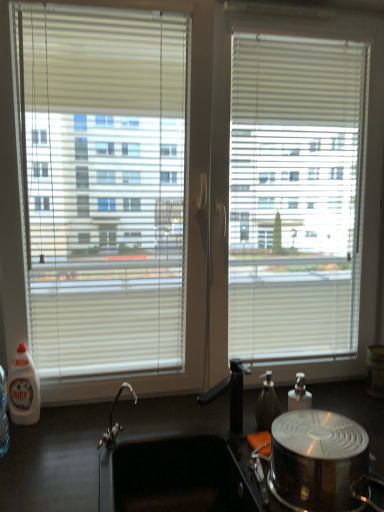
Question: Is shiny metallic pot at lower right next to white plastic bottle at left, which appears as the second bottle when viewed from the right?

Choices:
 (A) yes
 (B) no

Answer: (B)

Question: From the image's perspective, is shiny metallic pot at lower right below white plastic bottle at left, which appears as the second bottle when viewed from the right?

Choices:
 (A) no
 (B) yes

Answer: (B)

Question: Is shiny metallic pot at lower right to the right of white plastic bottle at left, which appears as the second bottle when viewed from the right, from the viewer's perspective?

Choices:
 (A) yes
 (B) no

Answer: (A)

Question: From a real-world perspective, is shiny metallic pot at lower right below white plastic bottle at left, which appears as the second bottle when viewed from the right?

Choices:
 (A) yes
 (B) no

Answer: (A)

Question: Does shiny metallic pot at lower right lie in front of white plastic bottle at left, placed as the first bottle when sorted from left to right?

Choices:
 (A) yes
 (B) no

Answer: (A)

Question: Would you say shiny metallic pot at lower right contains white plastic bottle at left, which appears as the second bottle when viewed from the right?

Choices:
 (A) yes
 (B) no

Answer: (B)

Question: Considering the relative positions of shiny metallic pot at lower right and transparent plastic soap dispenser at center-right, which is the first bottle from right to left, in the image provided, is shiny metallic pot at lower right to the left of transparent plastic soap dispenser at center-right, which is the first bottle from right to left, from the viewer's perspective?

Choices:
 (A) no
 (B) yes

Answer: (B)

Question: Is shiny metallic pot at lower right turned away from transparent plastic soap dispenser at center-right, which is the first bottle from right to left?

Choices:
 (A) no
 (B) yes

Answer: (B)

Question: Does shiny metallic pot at lower right appear on the right side of transparent plastic soap dispenser at center-right, which is the first bottle from right to left?

Choices:
 (A) no
 (B) yes

Answer: (A)

Question: From the image's perspective, is shiny metallic pot at lower right beneath transparent plastic soap dispenser at center-right, which appears as the second bottle when viewed from the left?

Choices:
 (A) yes
 (B) no

Answer: (A)

Question: Is shiny metallic pot at lower right directly adjacent to transparent plastic soap dispenser at center-right, which is the first bottle from right to left?

Choices:
 (A) yes
 (B) no

Answer: (B)

Question: Is shiny metallic pot at lower right not within transparent plastic soap dispenser at center-right, which is the first bottle from right to left?

Choices:
 (A) no
 (B) yes

Answer: (B)

Question: Is black matte countertop at lower center bigger than white plastic bottle at left, placed as the first bottle when sorted from left to right?

Choices:
 (A) no
 (B) yes

Answer: (B)